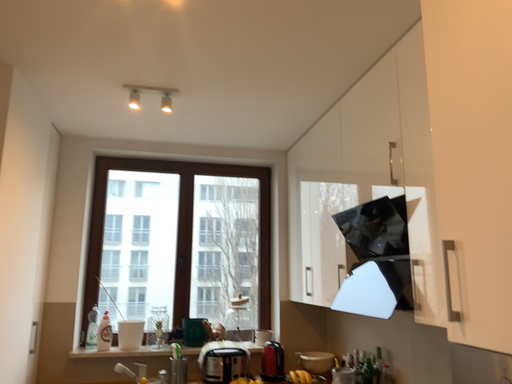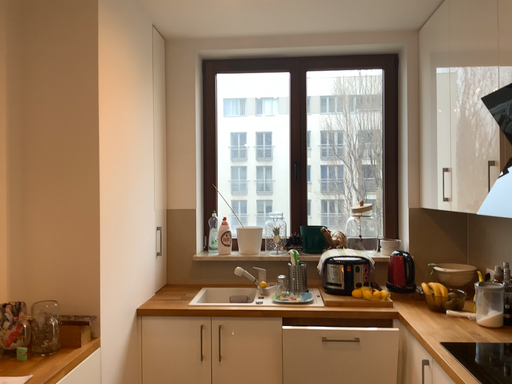
Question: How did the camera likely rotate when shooting the video?

Choices:
 (A) rotated right
 (B) rotated left

Answer: (B)